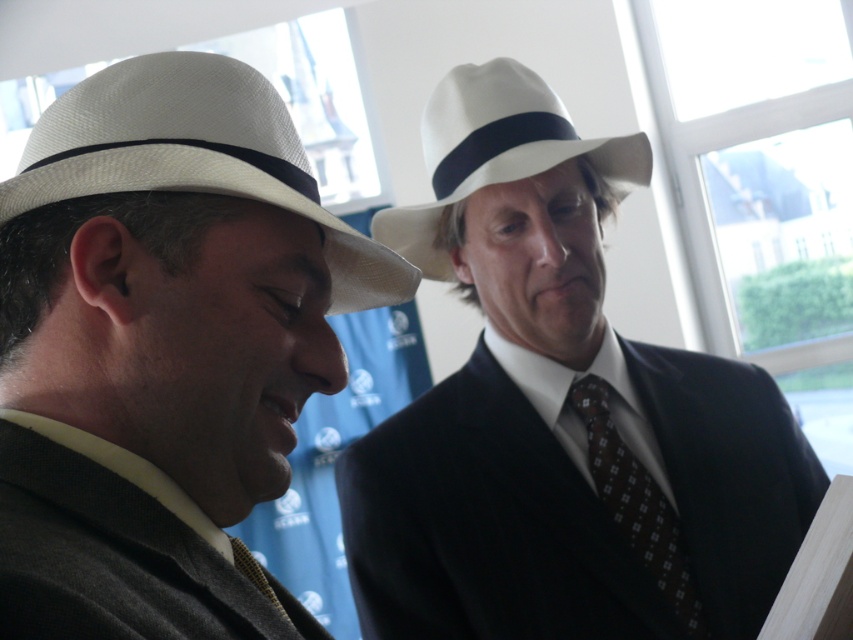
Question: Based on their relative distances, which object is farther from the white straw cowboy hat at left?

Choices:
 (A) white matte fedora at upper center
 (B) white felt cowboy hat at upper center
 (C) dark gray wool suit at lower left
 (D) brown dotted fabric tie at right

Answer: (D)

Question: Which object is positioned farthest from the brown dotted fabric tie at right?

Choices:
 (A) white felt cowboy hat at upper center
 (B) white straw cowboy hat at left
 (C) matte white hat at left
 (D) dark gray wool suit at lower left

Answer: (D)

Question: Can you confirm if white matte fedora at upper center is positioned to the right of white felt cowboy hat at upper center?

Choices:
 (A) no
 (B) yes

Answer: (B)

Question: Is white felt cowboy hat at upper center positioned in front of brown dotted fabric tie at right?

Choices:
 (A) no
 (B) yes

Answer: (A)

Question: Can you confirm if white matte fedora at upper center is bigger than white felt cowboy hat at upper center?

Choices:
 (A) yes
 (B) no

Answer: (A)

Question: Among these objects, which one is nearest to the camera?

Choices:
 (A) white straw cowboy hat at left
 (B) brown dotted fabric tie at right

Answer: (A)